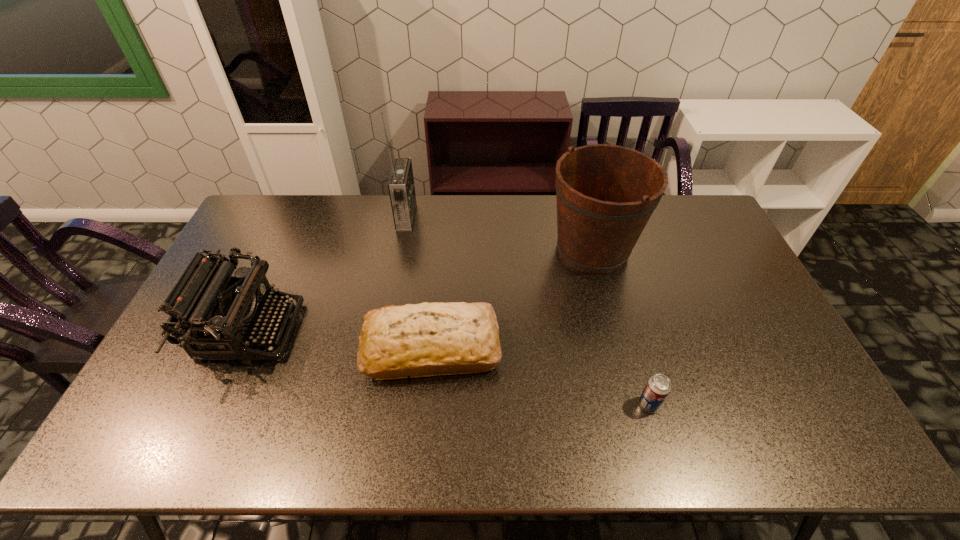
This screenshot has width=960, height=540. I want to click on vacant region between the third shortest object and the bucket, so click(421, 291).

Where is `free space between the fourth tallest object and the typewriter`? free space between the fourth tallest object and the typewriter is located at coordinates (341, 340).

Locate an element on the screen. The height and width of the screenshot is (540, 960). vacant point located between the bucket and the bread is located at coordinates (512, 299).

This screenshot has height=540, width=960. In order to click on vacant point located between the shortest object and the tallest object in this screenshot , I will do `click(528, 310)`.

What are the coordinates of `free space between the bread and the tallest object` in the screenshot? It's located at (419, 282).

Find the location of a particular element. empty space that is in between the second shortest object and the beer can is located at coordinates (540, 376).

Identify the location of free space that is in between the bread and the nearest object. click(x=540, y=376).

What are the coordinates of `blank region between the beer can and the bread` in the screenshot? It's located at (540, 376).

The height and width of the screenshot is (540, 960). Find the location of `empty location between the bread and the bucket`. empty location between the bread and the bucket is located at coordinates (512, 299).

Identify the location of free area in between the shortest object and the second shortest object. (540, 376).